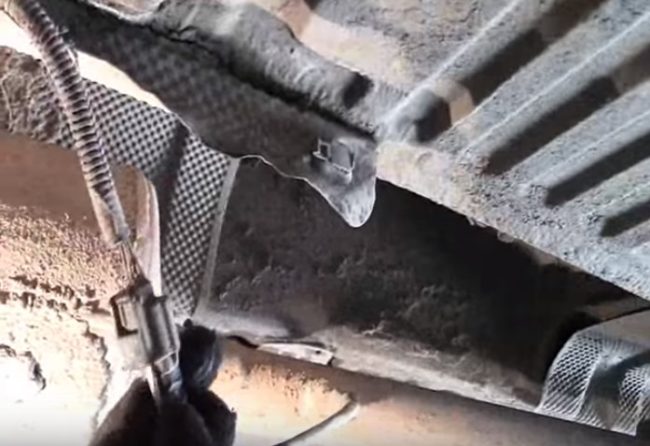
The image size is (650, 446). Find the location of `ceiling`. ceiling is located at coordinates (548, 78).